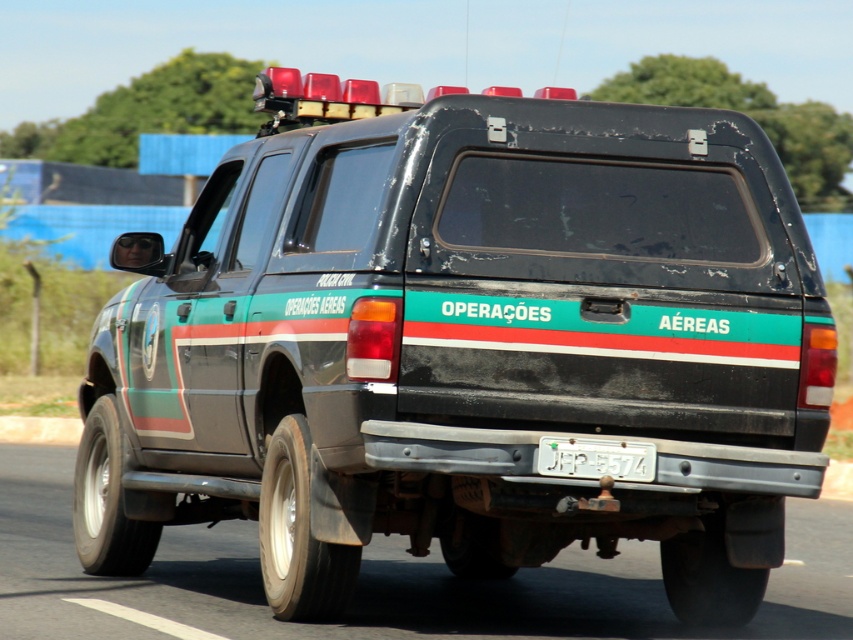
Question: Is gray rubber tire at lower center positioned in front of white plastic license plate at center?

Choices:
 (A) no
 (B) yes

Answer: (A)

Question: Is gray rubber tire at lower center thinner than white plastic license plate at center?

Choices:
 (A) no
 (B) yes

Answer: (B)

Question: Which object is farther from the camera taking this photo?

Choices:
 (A) gray rubber tire at lower center
 (B) white plastic license plate at center

Answer: (A)

Question: Which of the following is the closest to the observer?

Choices:
 (A) (548, 454)
 (B) (53, 448)

Answer: (A)

Question: Is gray rubber tire at lower center closer to the viewer compared to white plastic license plate at center?

Choices:
 (A) no
 (B) yes

Answer: (A)